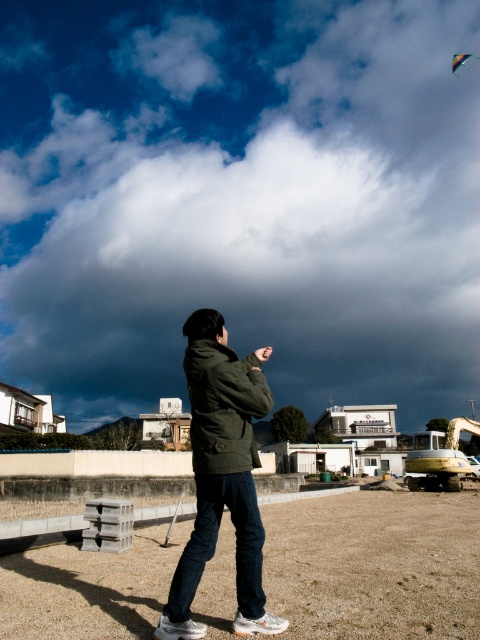
Can you confirm if cloudy sky at upper center is taller than olive-green jacket at center?

Correct, cloudy sky at upper center is much taller as olive-green jacket at center.

Based on the photo, which is below, cloudy sky at upper center or olive-green jacket at center?

olive-green jacket at center is lower down.

Between point (373, 294) and point (213, 384), which one is positioned behind?

The point (373, 294) is more distant.

Where is `cloudy sky at upper center`? Image resolution: width=480 pixels, height=640 pixels. cloudy sky at upper center is located at coordinates (240, 198).

Who is taller, cloudy sky at upper center or multicolored fabric kite at upper right?

cloudy sky at upper center

Where is `cloudy sky at upper center`? The image size is (480, 640). cloudy sky at upper center is located at coordinates (240, 198).

Is olive-green jacket at center wider than multicolored fabric kite at upper right?

In fact, olive-green jacket at center might be narrower than multicolored fabric kite at upper right.

Which is in front, point (204, 538) or point (467, 54)?

Point (204, 538) is in front.

Where is `olive-green jacket at center`? The width and height of the screenshot is (480, 640). olive-green jacket at center is located at coordinates (222, 476).